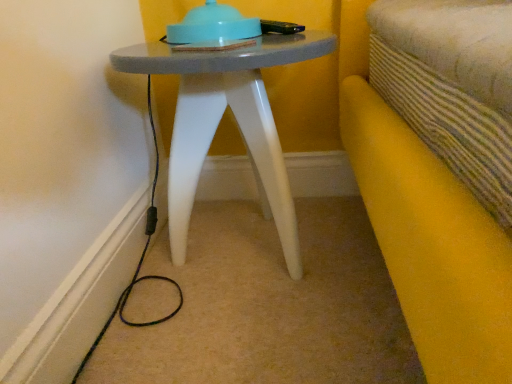
The width and height of the screenshot is (512, 384). I want to click on matte white stool at center, so click(x=220, y=119).

Measure the distance between matte white stool at center and camera.

matte white stool at center is 23.35 inches from camera.

Describe the element at coordinates (220, 119) in the screenshot. I see `matte white stool at center` at that location.

Locate an element on the screen. The width and height of the screenshot is (512, 384). matte white stool at center is located at coordinates (220, 119).